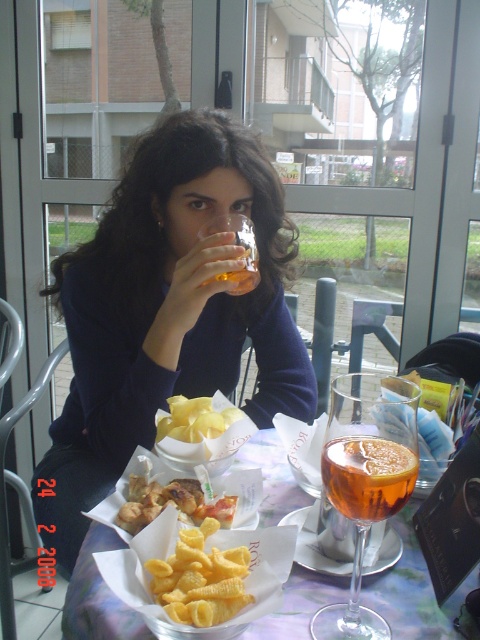
You are a delivery person who needs to place a 55 cm wide package on the table. The table has a point marked at coordinates point (82, 604). Can you fit the package on the table without overlapping the marked point?

The distance between the package and the marked point is 56.08 centimeters. Since the package is 55 cm wide, it can be placed on the table without overlapping the marked point as there is enough space between them.

You are a customer at the outdoor cafe and want to reach for the golden crispy fries at center without spilling the translucent glass at center. Which item should you move first?

The translucent glass at center is above the golden crispy fries at center, so you should move the translucent glass at center first to avoid spilling it while reaching for the fries.

From the picture: You are a waiter at the outdoor cafe and need to serve a customer. You have a new drink to place on the table. The existing items on the table include the translucent glass at center and the translucent glass drink at center. Which object is taller so you can ensure proper placement?

The translucent glass at center is taller than the translucent glass drink at center, so you should place the new drink accordingly to avoid blocking the view of the taller object.